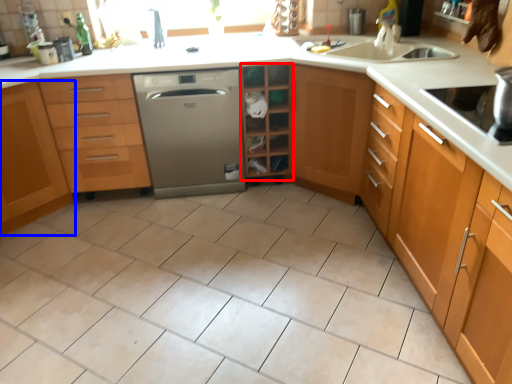
Question: Among these objects, which one is nearest to the camera, shelf (highlighted by a red box) or cabinetry (highlighted by a blue box)?

Choices:
 (A) shelf
 (B) cabinetry

Answer: (B)